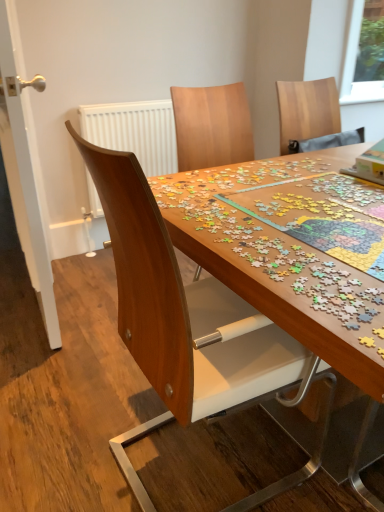
At what (x,y) coordinates should I click in order to perform the action: click on wooden chair at center. Please return your answer as a coordinate pair (x, y). The height and width of the screenshot is (512, 384). Looking at the image, I should click on (176, 314).

The width and height of the screenshot is (384, 512). What do you see at coordinates (176, 314) in the screenshot? I see `wooden chair at center` at bounding box center [176, 314].

The image size is (384, 512). I want to click on wooden chair at center, so click(x=176, y=314).